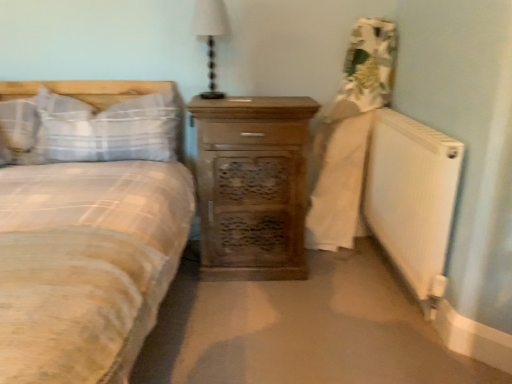
Question: Is white plaid pillow at left, arranged as the second pillow when viewed from the right, situated inside white matte radiator at lower right or outside?

Choices:
 (A) outside
 (B) inside

Answer: (A)

Question: Relative to white matte radiator at lower right, is white plaid pillow at left, which appears as the first pillow when viewed from the left, in front or behind?

Choices:
 (A) front
 (B) behind

Answer: (B)

Question: Which of these objects is positioned farthest from the white matte radiator at lower right?

Choices:
 (A) plaid fabric pillow at left, which is the second pillow in left-to-right order
 (B) white plaid pillow at left, arranged as the second pillow when viewed from the right
 (C) white fabric lampshade at upper center
 (D) wooden chest of drawers at center

Answer: (B)

Question: Estimate the real-world distances between objects in this image. Which object is farther from the white plaid pillow at left, arranged as the second pillow when viewed from the right?

Choices:
 (A) plaid fabric pillow at left, the first pillow from the right
 (B) wooden chest of drawers at center
 (C) white matte radiator at lower right
 (D) white fabric lampshade at upper center

Answer: (C)